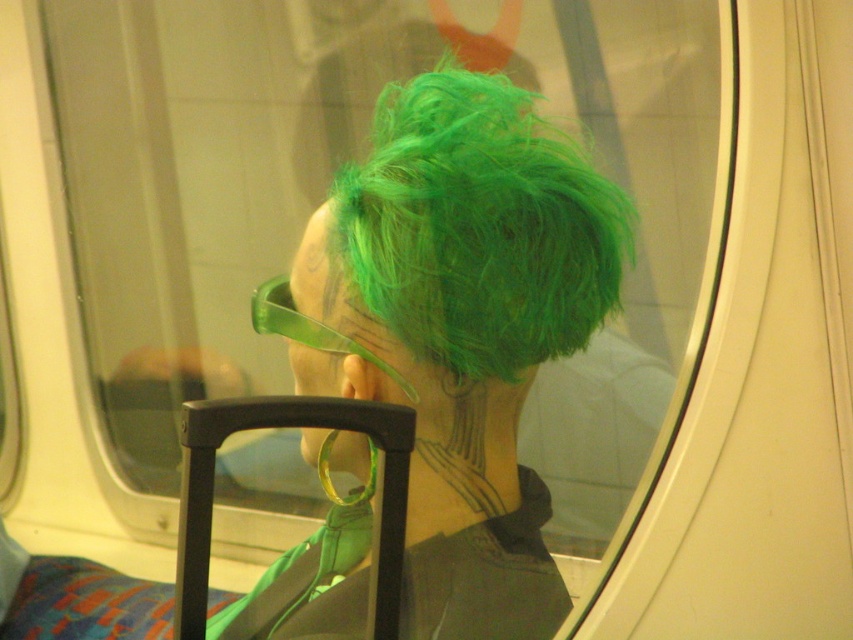
You are a photographer trying to capture the best angle of the person in the train scene. You notice the green matte wig at upper center and the green fluffy hair at center. Which object has a greater width when viewed from your current position?

The green matte wig at upper center has a greater width than the green fluffy hair at center.

You are a photographer trying to capture a portrait of the person with the green hair. You want to ensure that both the green matte wig at upper center and the green fluffy hair at center are clearly visible in the frame. Given their height difference, what adjustment should you make to your camera angle?

Since the green matte wig at upper center is much taller than the green fluffy hair at center, you should angle the camera slightly downward to ensure both elements are in clear view without one blocking the other.

You are a hairstylist trying to style a client with both the green matte wig at upper center and the green fluffy hair at center. The client wants to know which one takes up more space. Which one should you tell them?

The green matte wig at upper center is larger in size than the green fluffy hair at center, so it takes up more space.